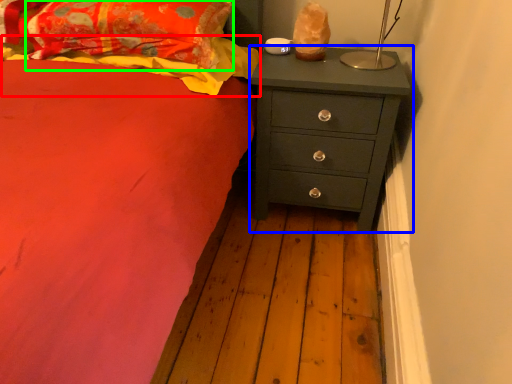
Question: Which object is positioned closest to blanket (highlighted by a red box)? Select from chest of drawers (highlighted by a blue box) and pillow (highlighted by a green box).

Choices:
 (A) chest of drawers
 (B) pillow

Answer: (B)